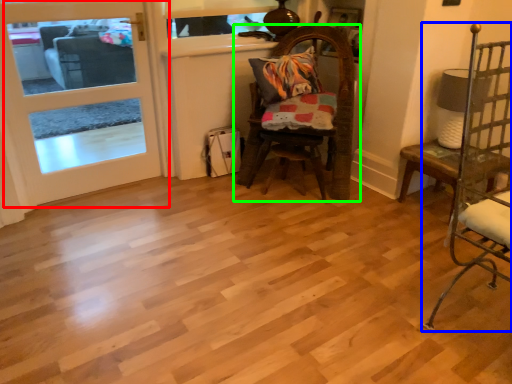
Question: Estimate the real-world distances between objects in this image. Which object is closer to door (highlighted by a red box), chair (highlighted by a blue box) or chair (highlighted by a green box)?

Choices:
 (A) chair
 (B) chair

Answer: (B)